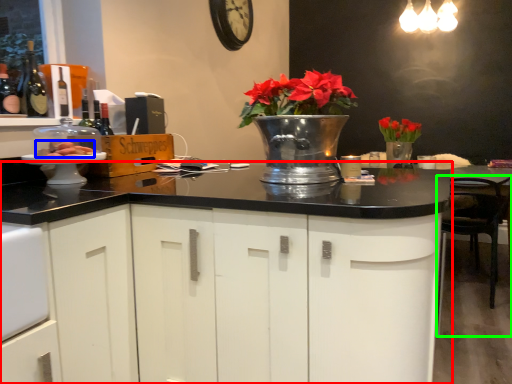
Question: Which object is the closest to the cabinetry (highlighted by a red box)? Choose among these: food (highlighted by a blue box) or chair (highlighted by a green box).

Choices:
 (A) food
 (B) chair

Answer: (A)